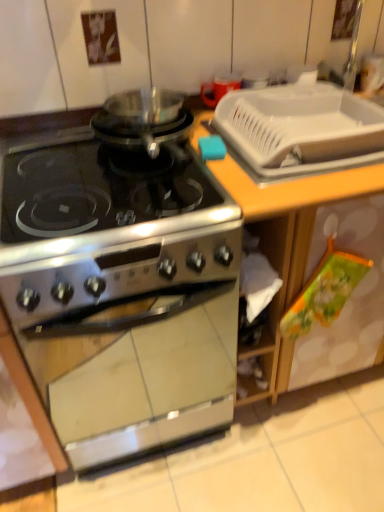
Question: Relative to white plastic sink at upper right, is wooden countertop at center in front or behind?

Choices:
 (A) behind
 (B) front

Answer: (B)

Question: In terms of size, does wooden countertop at center appear bigger or smaller than white plastic sink at upper right?

Choices:
 (A) small
 (B) big

Answer: (B)

Question: Which of these objects is positioned closest to the white plastic tray at upper right?

Choices:
 (A) white plastic sink at upper right
 (B) wooden countertop at center
 (C) satin silver gas stove at center
 (D) stainless steel stove at center

Answer: (A)

Question: Which of these objects is positioned closest to the satin silver gas stove at center?

Choices:
 (A) stainless steel stove at center
 (B) white plastic sink at upper right
 (C) white plastic tray at upper right
 (D) wooden countertop at center

Answer: (A)